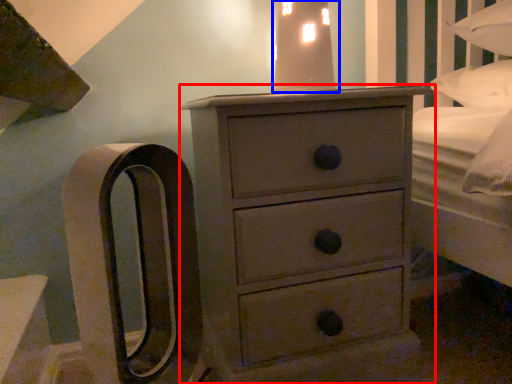
Question: Which of the following is the closest to the observer, chest of drawers (highlighted by a red box) or bedside lamp (highlighted by a blue box)?

Choices:
 (A) chest of drawers
 (B) bedside lamp

Answer: (A)